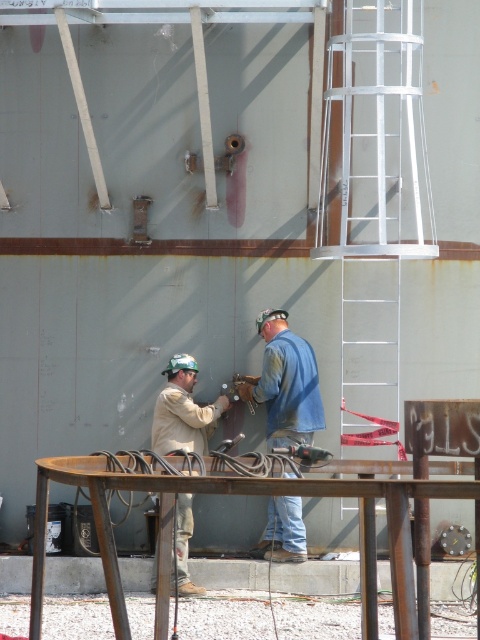
Question: Based on their relative distances, which object is nearer to the blue denim jacket at center?

Choices:
 (A) white metallic ladder at center right
 (B) tan fabric shirt at center

Answer: (B)

Question: Which point is closer to the camera taking this photo?

Choices:
 (A) (333, 212)
 (B) (266, 413)

Answer: (B)

Question: Which object is closer to the camera taking this photo?

Choices:
 (A) blue denim jacket at center
 (B) white metallic ladder at center right

Answer: (B)

Question: Considering the relative positions of white metallic ladder at center right and blue denim jacket at center in the image provided, where is white metallic ladder at center right located with respect to blue denim jacket at center?

Choices:
 (A) right
 (B) left

Answer: (A)

Question: Considering the relative positions of blue denim jacket at center and tan fabric shirt at center in the image provided, where is blue denim jacket at center located with respect to tan fabric shirt at center?

Choices:
 (A) right
 (B) left

Answer: (A)

Question: Is white metallic ladder at center right smaller than tan fabric shirt at center?

Choices:
 (A) no
 (B) yes

Answer: (A)